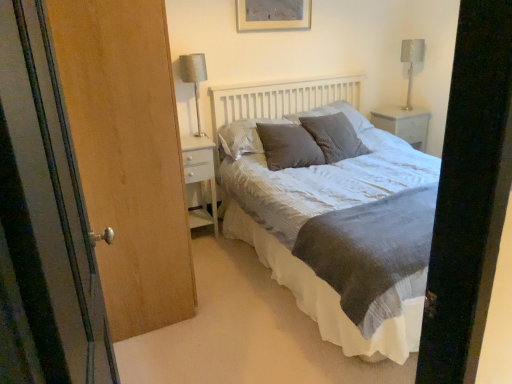
Question: Considering the relative sizes of white wood nightstand at left, marked as the second nightstand in a right-to-left arrangement, and matte gray picture frame at upper center in the image provided, is white wood nightstand at left, marked as the second nightstand in a right-to-left arrangement, shorter than matte gray picture frame at upper center?

Choices:
 (A) yes
 (B) no

Answer: (B)

Question: From a real-world perspective, is white wood nightstand at left, which appears as the 2th nightstand when viewed from the top, positioned over matte gray picture frame at upper center based on gravity?

Choices:
 (A) yes
 (B) no

Answer: (B)

Question: Is white wood nightstand at left, the second nightstand viewed from the back, bigger than matte gray picture frame at upper center?

Choices:
 (A) yes
 (B) no

Answer: (A)

Question: Is white wood nightstand at left, arranged as the first nightstand when viewed from the left, outside of matte gray picture frame at upper center?

Choices:
 (A) yes
 (B) no

Answer: (A)

Question: From a real-world perspective, is white wood nightstand at left, which appears as the 2th nightstand when viewed from the top, under matte gray picture frame at upper center?

Choices:
 (A) no
 (B) yes

Answer: (B)

Question: Are white wood nightstand at left, the first nightstand ordered from the bottom, and matte gray picture frame at upper center far apart?

Choices:
 (A) yes
 (B) no

Answer: (A)

Question: Is gray textured pillow at center, which is the 2th pillow in left-to-right order, oriented away from textured gray pillow at center, the 1th pillow in the right-to-left sequence?

Choices:
 (A) no
 (B) yes

Answer: (A)

Question: Considering the relative sizes of gray textured pillow at center, which is the 2th pillow in left-to-right order, and textured gray pillow at center, the third pillow in the left-to-right sequence, in the image provided, is gray textured pillow at center, which is the 2th pillow in left-to-right order, taller than textured gray pillow at center, the third pillow in the left-to-right sequence,?

Choices:
 (A) yes
 (B) no

Answer: (B)

Question: Is textured gray pillow at center, the 1th pillow in the right-to-left sequence, located within gray textured pillow at center, acting as the 2th pillow starting from the right?

Choices:
 (A) no
 (B) yes

Answer: (A)

Question: From the image's perspective, is gray textured pillow at center, acting as the 2th pillow starting from the right, below textured gray pillow at center, the third pillow in the left-to-right sequence?

Choices:
 (A) no
 (B) yes

Answer: (B)

Question: Is gray textured pillow at center, acting as the 2th pillow starting from the right, positioned behind textured gray pillow at center, the third pillow in the left-to-right sequence?

Choices:
 (A) yes
 (B) no

Answer: (B)

Question: From a real-world perspective, is gray textured pillow at center, which is the 2th pillow in left-to-right order, on top of textured gray pillow at center, the 1th pillow in the right-to-left sequence?

Choices:
 (A) yes
 (B) no

Answer: (B)

Question: Could you tell me if matte gray picture frame at upper center is facing textured gray pillow at center, arranged as the first pillow when viewed from the left?

Choices:
 (A) no
 (B) yes

Answer: (A)